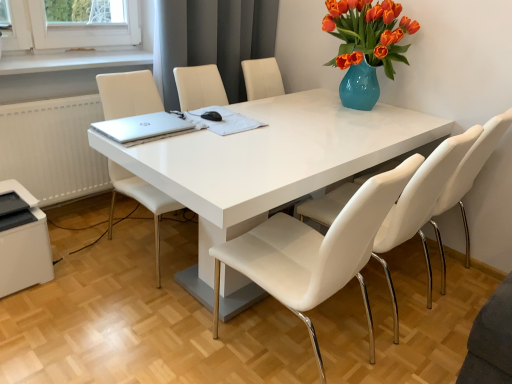
Locate an element on the screen. The width and height of the screenshot is (512, 384). unoccupied area in front of white leather chair at center, acting as the third chair starting from the right is located at coordinates (127, 308).